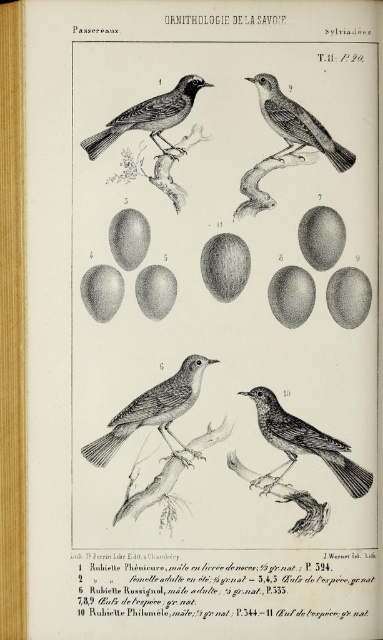
Between point (189, 80) and point (310, 125), which one is positioned in front?

Point (189, 80)

The height and width of the screenshot is (640, 383). I want to click on black textured bird at upper left, so click(x=150, y=116).

Which is more to the right, grayish-brown bird at center or smooth black bird at center?

From the viewer's perspective, smooth black bird at center appears more on the right side.

Is grayish-brown bird at center taller than smooth black bird at center?

Yes.

Is point (150, 420) positioned in front of point (363, 467)?

No, (150, 420) is further to viewer.

Identify the location of grayish-brown bird at center. The height and width of the screenshot is (640, 383). (153, 412).

Can you confirm if grayish-brown bird at center is positioned to the right of black textured bird at upper left?

Indeed, grayish-brown bird at center is positioned on the right side of black textured bird at upper left.

Does grayish-brown bird at center have a lesser height compared to black textured bird at upper left?

No, grayish-brown bird at center is not shorter than black textured bird at upper left.

Is point (163, 433) closer to viewer compared to point (157, 145)?

No.

Where is `grayish-brown bird at center`? grayish-brown bird at center is located at coordinates (153, 412).